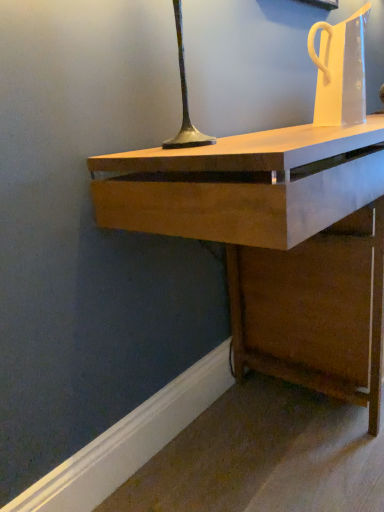
Question: Can you confirm if wooden desk at center is taller than transparent plastic jug at upper right?

Choices:
 (A) no
 (B) yes

Answer: (B)

Question: From the image's perspective, is wooden desk at center on transparent plastic jug at upper right?

Choices:
 (A) no
 (B) yes

Answer: (A)

Question: Can you confirm if wooden desk at center is thinner than transparent plastic jug at upper right?

Choices:
 (A) yes
 (B) no

Answer: (B)

Question: Is wooden desk at center to the right of transparent plastic jug at upper right from the viewer's perspective?

Choices:
 (A) yes
 (B) no

Answer: (A)

Question: Can we say wooden desk at center lies outside transparent plastic jug at upper right?

Choices:
 (A) no
 (B) yes

Answer: (B)

Question: Considering the relative sizes of wooden desk at center and transparent plastic jug at upper right in the image provided, is wooden desk at center wider than transparent plastic jug at upper right?

Choices:
 (A) yes
 (B) no

Answer: (A)

Question: Does transparent plastic jug at upper right have a smaller size compared to wooden desk at center?

Choices:
 (A) no
 (B) yes

Answer: (B)

Question: Can you confirm if transparent plastic jug at upper right is shorter than wooden desk at center?

Choices:
 (A) yes
 (B) no

Answer: (A)

Question: Is transparent plastic jug at upper right at the right side of wooden desk at center?

Choices:
 (A) yes
 (B) no

Answer: (B)

Question: Is transparent plastic jug at upper right positioned beyond the bounds of wooden desk at center?

Choices:
 (A) yes
 (B) no

Answer: (A)

Question: From a real-world perspective, does transparent plastic jug at upper right stand above wooden desk at center?

Choices:
 (A) no
 (B) yes

Answer: (B)

Question: Is transparent plastic jug at upper right facing towards wooden desk at center?

Choices:
 (A) no
 (B) yes

Answer: (A)

Question: Is wooden desk at center inside or outside of transparent plastic jug at upper right?

Choices:
 (A) inside
 (B) outside

Answer: (B)